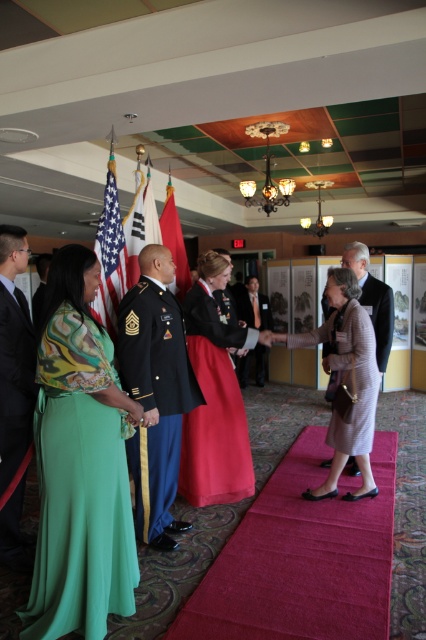
Question: From the image, what is the correct spatial relationship of red satin dress at center in relation to green silk dress at lower left?

Choices:
 (A) below
 (B) above

Answer: (B)

Question: Does shiny blue uniform at center lie behind dark gray wool suit at right?

Choices:
 (A) yes
 (B) no

Answer: (B)

Question: Which of the following is the closest to the observer?

Choices:
 (A) (146, 276)
 (B) (267, 317)

Answer: (A)

Question: Which point is farther to the camera?

Choices:
 (A) red silk flag at center
 (B) green satin dress at left
 (C) white fabric flag at center
 (D) dark gray wool suit at right

Answer: (D)

Question: Is light brown textured dress at center above shiny black uniform at center?

Choices:
 (A) no
 (B) yes

Answer: (A)

Question: Among these objects, which one is nearest to the camera?

Choices:
 (A) light brown wool dress at center
 (B) dark gray wool suit at right

Answer: (A)